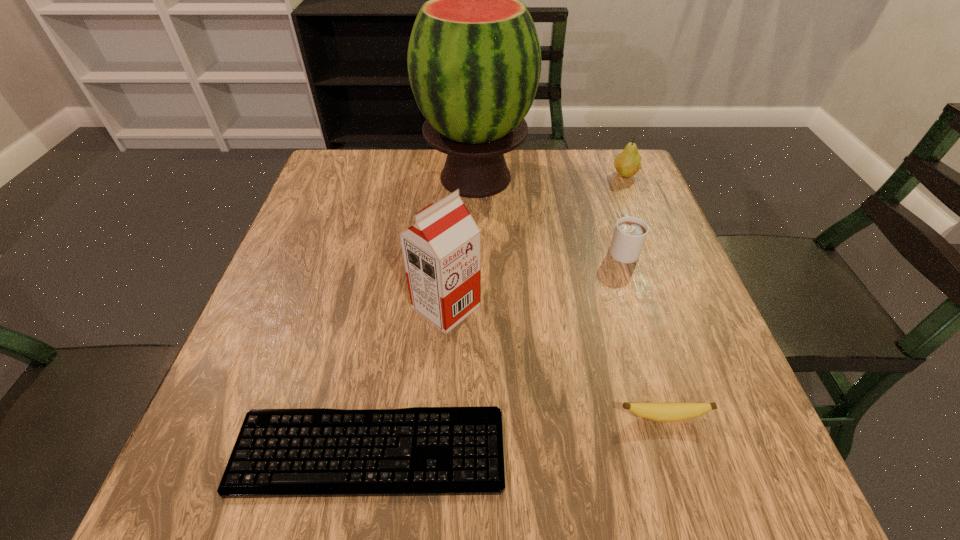
The image size is (960, 540). In order to click on free space at the near left corner of the desktop in this screenshot , I will do `click(213, 450)`.

Identify the location of vacant space at the far right corner of the desktop. (625, 178).

Where is `free space that is in between the computer keyboard and the fourth shortest object`? The height and width of the screenshot is (540, 960). free space that is in between the computer keyboard and the fourth shortest object is located at coordinates (497, 313).

You are a GUI agent. You are given a task and a screenshot of the screen. Output one action in this format:
    pyautogui.click(x=<x>, y=<y>)
    Task: Click on the vacant area between the cappuccino and the banana
    
    Given the screenshot: What is the action you would take?
    pyautogui.click(x=643, y=333)

In order to click on unoccupied position between the shortest object and the pear in this screenshot , I will do `click(497, 313)`.

Where is `free space that is in between the shortest object and the cappuccino`? The height and width of the screenshot is (540, 960). free space that is in between the shortest object and the cappuccino is located at coordinates (496, 350).

In order to click on vacant region between the fourth farthest object and the shortest object in this screenshot , I will do `click(408, 379)`.

This screenshot has height=540, width=960. Find the location of `vacant area that lies between the third nearest object and the fifth tallest object`. vacant area that lies between the third nearest object and the fifth tallest object is located at coordinates (555, 362).

At what (x,y) coordinates should I click in order to perform the action: click on free area in between the watermelon and the banana. Please return your answer as a coordinate pair (x, y). Looking at the image, I should click on (569, 298).

You are a GUI agent. You are given a task and a screenshot of the screen. Output one action in this format:
    pyautogui.click(x=<x>, y=<y>)
    Task: Click on the free space between the shortest object and the pear
    Image resolution: width=960 pixels, height=540 pixels.
    Given the screenshot: What is the action you would take?
    497,313